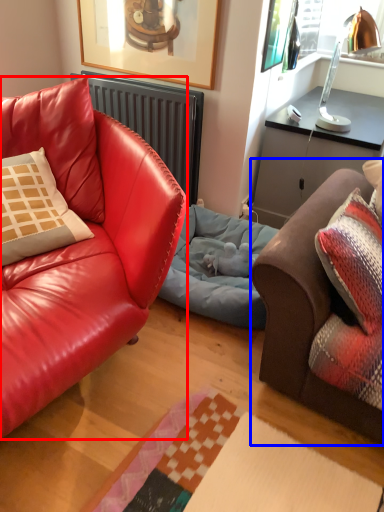
Question: Among these objects, which one is nearest to the camera, studio couch (highlighted by a red box) or studio couch (highlighted by a blue box)?

Choices:
 (A) studio couch
 (B) studio couch

Answer: (A)